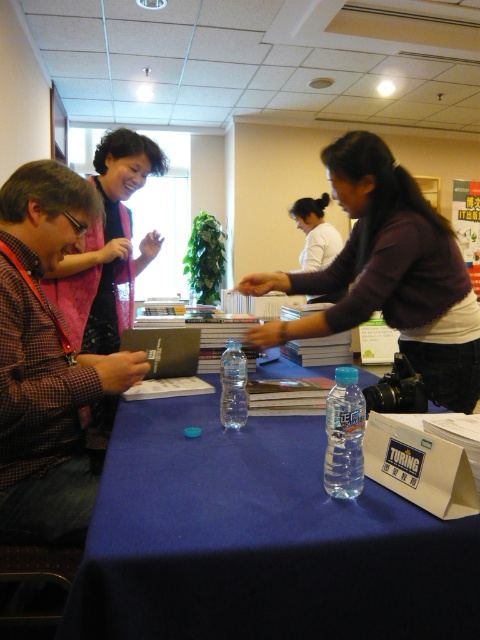
You are organizing a book signing event and need to place a new attendee between the brown checkered shirt at left and the dark brown sweater at center. Where should you position them?

The new attendee should be positioned between the brown checkered shirt at left and the dark brown sweater at center, as the brown checkered shirt at left is to the left of the dark brown sweater at center.

You are an event organizer checking the setup for a book signing. You see the brown checkered shirt at left and the clear plastic water bottle at center. Which object is closer to the front of the scene?

The brown checkered shirt at left is closer to the front of the scene because the clear plastic water bottle at center is behind it.